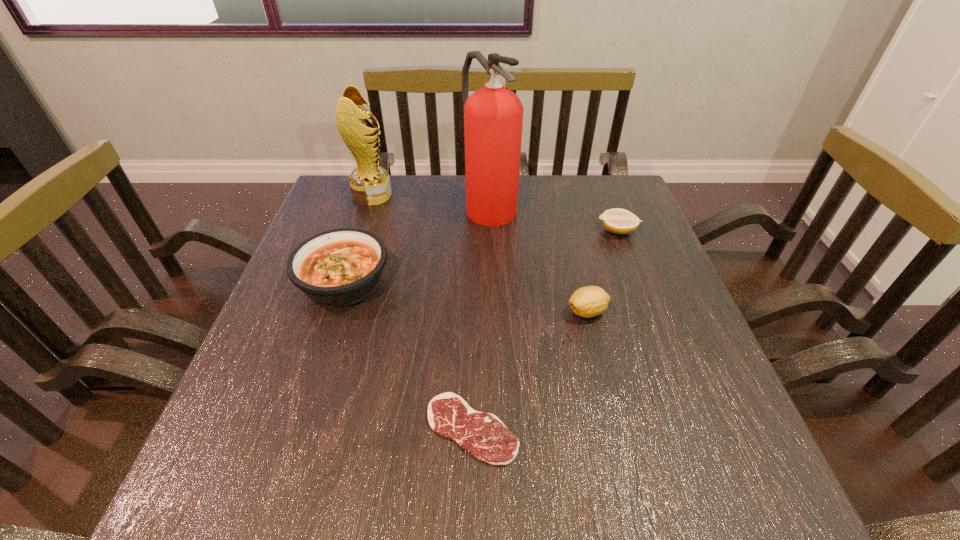
Image resolution: width=960 pixels, height=540 pixels. What are the coordinates of `vacant space that satisfies the following two spatial constraints: 1. on the front-facing side of the farther lemon; 2. on the left side of the second tallest object` in the screenshot? It's located at (361, 231).

The image size is (960, 540). Identify the location of blank space that satisfies the following two spatial constraints: 1. on the front-facing side of the fifth shortest object; 2. on the back side of the stew. coord(344,282).

This screenshot has height=540, width=960. I want to click on vacant region that satisfies the following two spatial constraints: 1. on the front side of the right lemon; 2. at the stem end of the third shortest object, so click(647, 312).

Where is `free location that satisfies the following two spatial constraints: 1. on the handle side of the fire extinguisher; 2. on the right side of the rightmost object`? free location that satisfies the following two spatial constraints: 1. on the handle side of the fire extinguisher; 2. on the right side of the rightmost object is located at coordinates (491, 231).